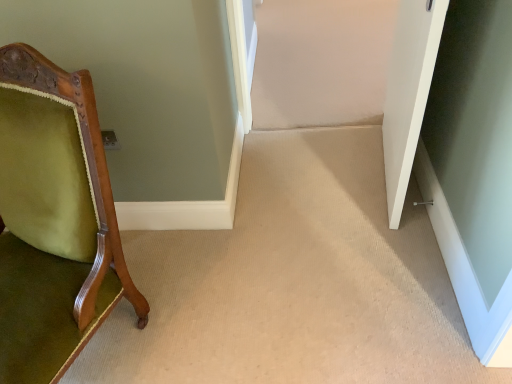
Question: Is green velvet chair at left taller or shorter than clear glass door at lower right?

Choices:
 (A) tall
 (B) short

Answer: (A)

Question: Do you think green velvet chair at left is within clear glass door at lower right, or outside of it?

Choices:
 (A) inside
 (B) outside

Answer: (B)

Question: Which object is the closest to the green velvet chair at left?

Choices:
 (A) white matte door at right
 (B) clear glass door at lower right

Answer: (A)

Question: Which object is positioned farthest from the green velvet chair at left?

Choices:
 (A) clear glass door at lower right
 (B) white matte door at right

Answer: (A)